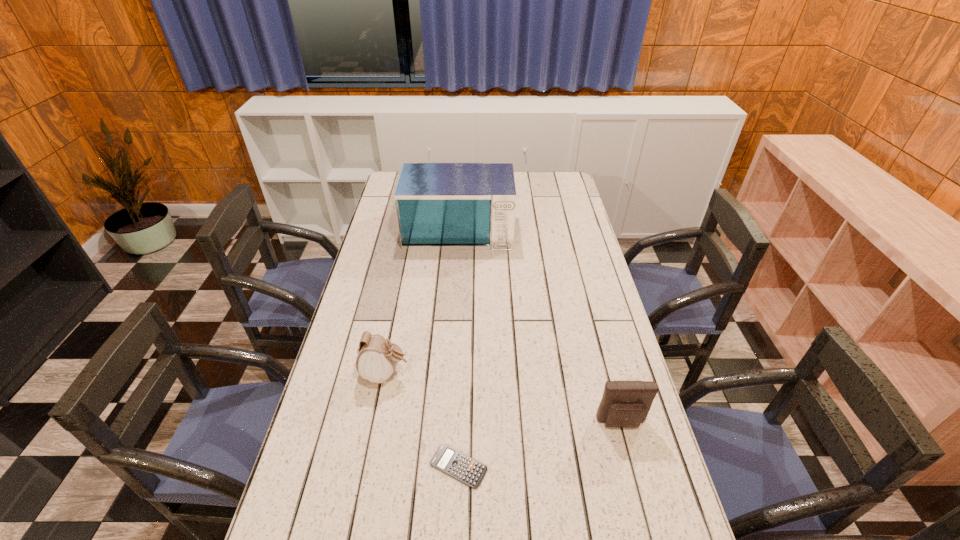
The height and width of the screenshot is (540, 960). I want to click on vacant space situated with an open flap on the right pouch, so (648, 525).

This screenshot has width=960, height=540. I want to click on free space located 0.350m on the right of the calculator, so click(629, 467).

This screenshot has height=540, width=960. Identify the location of microwave oven at the left edge. (440, 206).

The width and height of the screenshot is (960, 540). In order to click on pouch that is positioned at the left edge in this screenshot , I will do coord(377,358).

Identify the location of object that is at the right edge. [x=625, y=404].

In the image, there is a desktop. At what (x,y) coordinates should I click in order to perform the action: click on vacant area at the left edge. Please return your answer as a coordinate pair (x, y). This screenshot has height=540, width=960. Looking at the image, I should click on (391, 255).

This screenshot has width=960, height=540. Find the location of `vacant space at the right edge of the desktop`. vacant space at the right edge of the desktop is located at coordinates (599, 388).

Where is `vacant space at the far left corner`? The height and width of the screenshot is (540, 960). vacant space at the far left corner is located at coordinates (389, 186).

I want to click on free space between the nearest object and the farthest object, so click(459, 347).

Locate an element on the screen. The image size is (960, 540). vacant area between the calculator and the farther pouch is located at coordinates (422, 420).